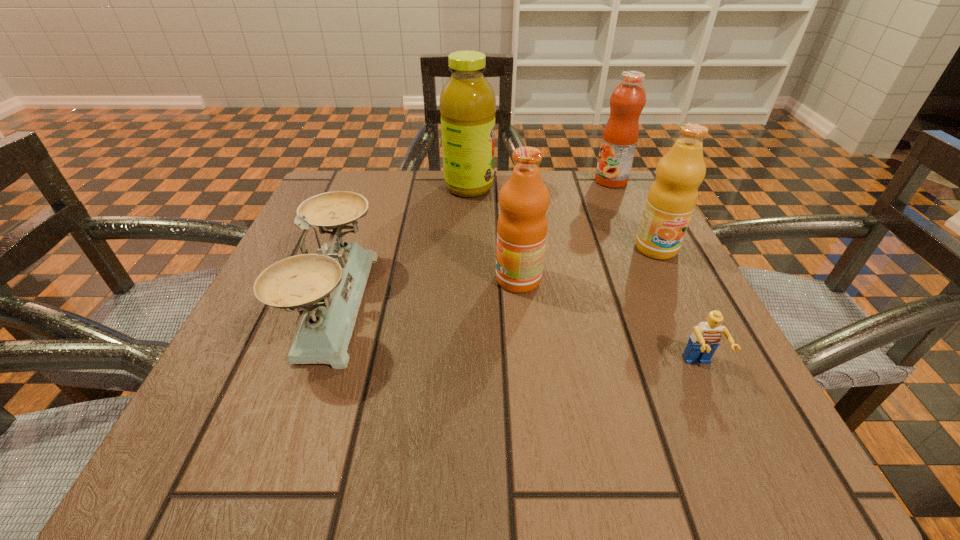
This screenshot has height=540, width=960. Identify the location of vacant space positioned 0.090m on the face of the shortest object. (734, 440).

Locate an element on the screen. object present at the left edge is located at coordinates (327, 287).

I want to click on Lego at the right edge, so click(x=705, y=339).

At what (x,y) coordinates should I click in order to perform the action: click on object that is at the far right corner. Please return your answer as a coordinate pair (x, y). The width and height of the screenshot is (960, 540). Looking at the image, I should click on (620, 136).

Find the location of `free space at the far edge of the desktop`. free space at the far edge of the desktop is located at coordinates (551, 227).

You are a GUI agent. You are given a task and a screenshot of the screen. Output one action in this format:
    pyautogui.click(x=<x>, y=<y>)
    Task: Click on the vacant space at the left edge of the desktop
    The height and width of the screenshot is (540, 960).
    Given the screenshot: What is the action you would take?
    pyautogui.click(x=227, y=393)

What are the coordinates of `free space at the right edge` in the screenshot? It's located at pyautogui.click(x=630, y=254).

Identify the location of vacant space at the far left corner of the desktop. (323, 192).

This screenshot has height=540, width=960. In order to click on vacant space at the near left corner of the desktop in this screenshot , I will do `click(206, 427)`.

Where is `vacant space at the far right corner`? vacant space at the far right corner is located at coordinates (581, 184).